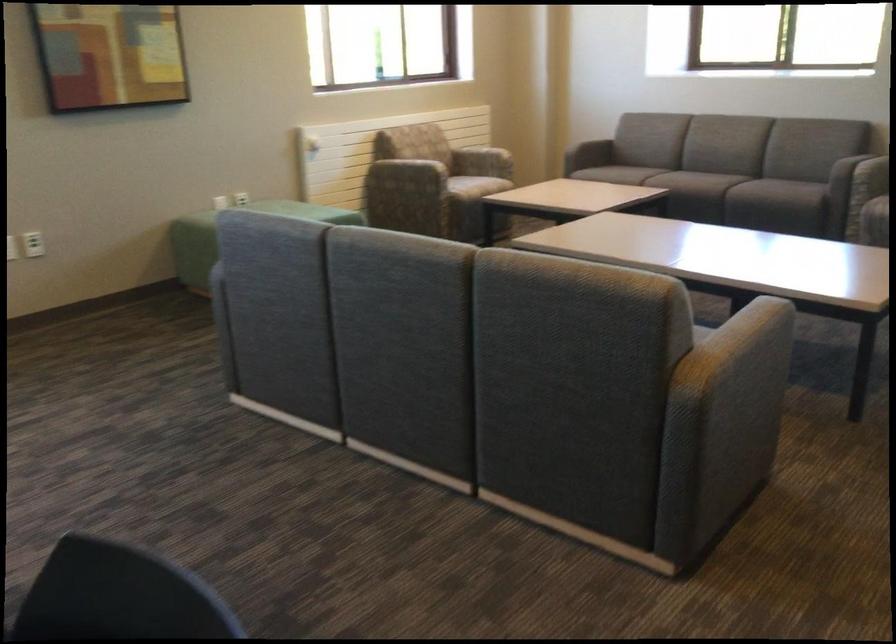
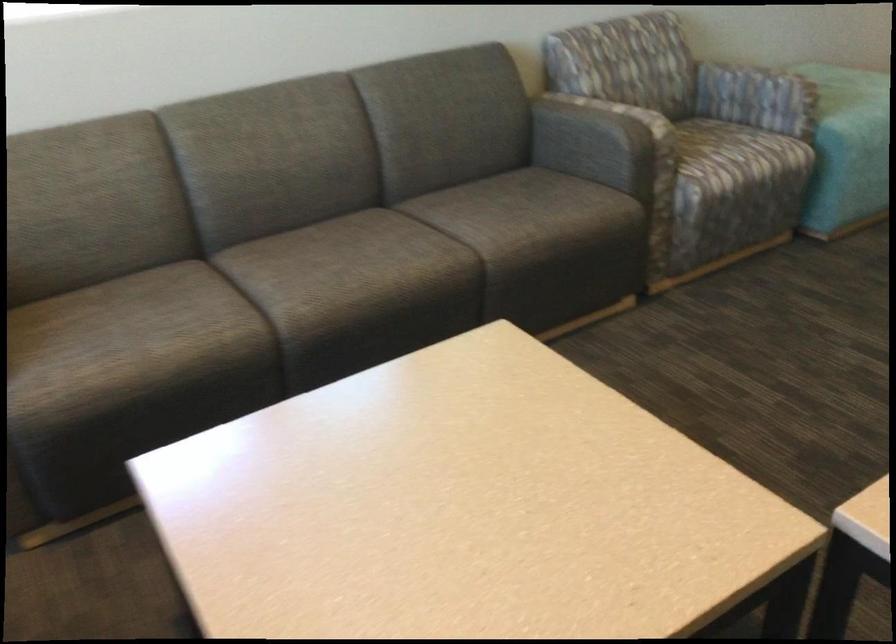
In the second image, find the point that corresponds to point 685,180 in the first image.

(427, 269)